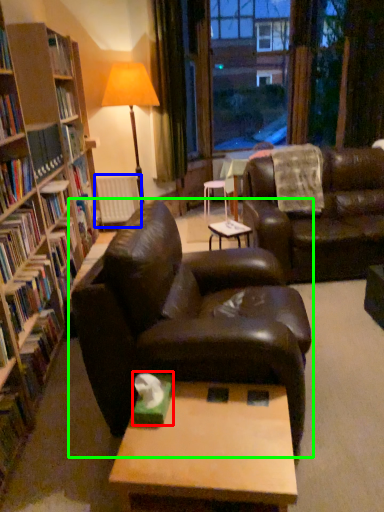
Question: Which object is positioned farthest from paperback book (highlighted by a red box)? Select from radiator (highlighted by a blue box) and studio couch (highlighted by a green box).

Choices:
 (A) radiator
 (B) studio couch

Answer: (A)